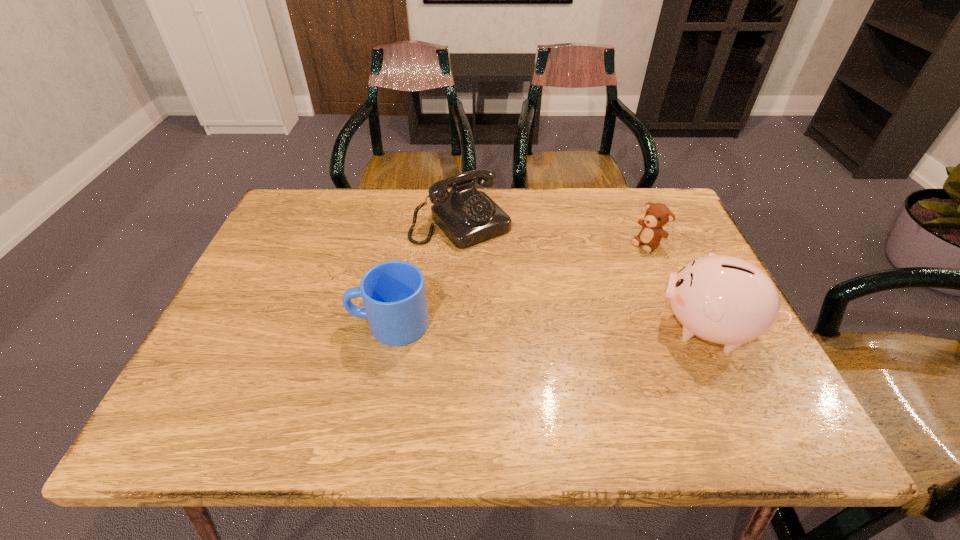
The image size is (960, 540). What are the coordinates of `empty space between the piggy bank and the mug` in the screenshot? It's located at (548, 326).

Locate which object ranks in proximity to the mug. Please provide its 2D coordinates. Your answer should be formatted as a tuple, i.e. [(x, y)], where the tuple contains the x and y coordinates of a point satisfying the conditions above.

[(467, 217)]

At what (x,y) coordinates should I click in order to perform the action: click on object that is the second closest to the telephone. Please return your answer as a coordinate pair (x, y). Looking at the image, I should click on (657, 215).